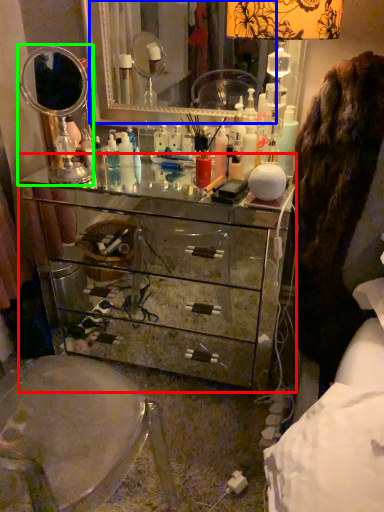
Question: Estimate the real-world distances between objects in this image. Which object is closer to chest of drawers (highlighted by a red box), mirror (highlighted by a blue box) or mirror (highlighted by a green box)?

Choices:
 (A) mirror
 (B) mirror

Answer: (B)